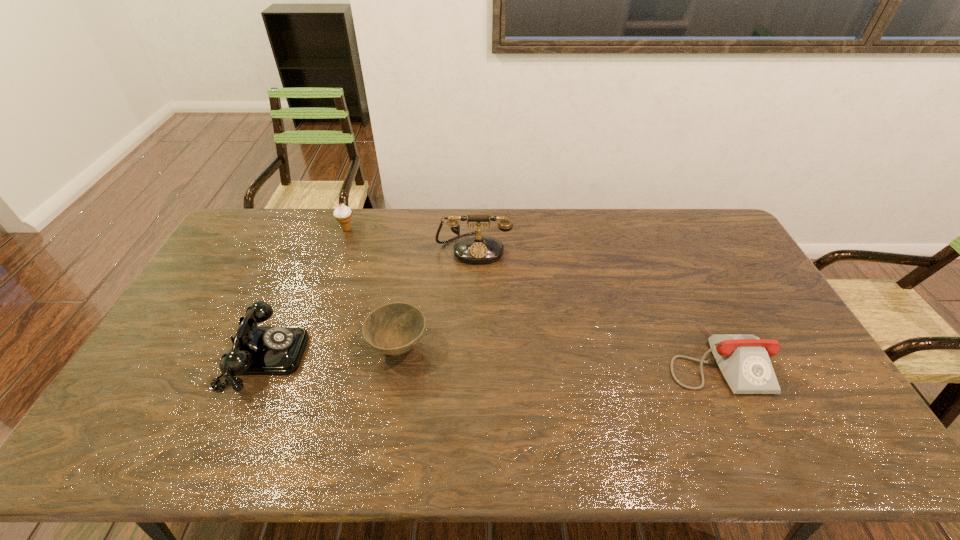
Where is `free area in between the icecream and the tallest object`? This screenshot has height=540, width=960. free area in between the icecream and the tallest object is located at coordinates (410, 239).

Identify the location of vacant space that is in between the tallest object and the bowl. The height and width of the screenshot is (540, 960). (436, 298).

This screenshot has height=540, width=960. Identify the location of vacant space that is in between the second tallest telephone and the icecream. (306, 293).

Identify the location of empty space that is in between the tallest telephone and the icecream. This screenshot has width=960, height=540. [x=410, y=239].

The width and height of the screenshot is (960, 540). I want to click on unoccupied area between the bowl and the farthest telephone, so click(x=436, y=298).

At what (x,y) coordinates should I click in order to perform the action: click on free space between the icecream and the second shortest telephone. Please return your answer as a coordinate pair (x, y). Looking at the image, I should click on (306, 293).

The height and width of the screenshot is (540, 960). Identify the location of free space between the bowl and the icecream. (372, 288).

Identify the location of free space between the bowl and the shortest telephone. The height and width of the screenshot is (540, 960). (557, 353).

Where is `free space between the bowl and the icecream`? The image size is (960, 540). free space between the bowl and the icecream is located at coordinates (372, 288).

Identify which object is located as the second nearest to the icecream. Please provide its 2D coordinates. Your answer should be formatted as a tuple, i.e. [(x, y)], where the tuple contains the x and y coordinates of a point satisfying the conditions above.

[(256, 350)]